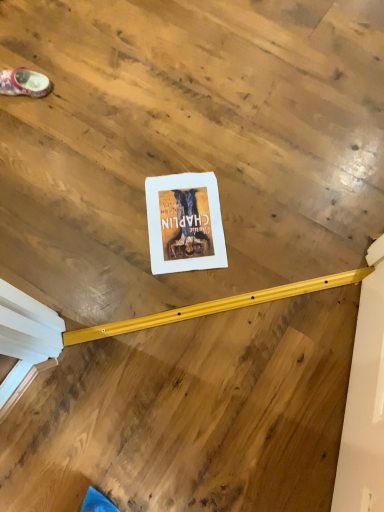
Question: From a real-world perspective, is white paper at center above or below matte pink fabric slipper at upper left?

Choices:
 (A) below
 (B) above

Answer: (A)

Question: In terms of size, does white paper at center appear bigger or smaller than matte pink fabric slipper at upper left?

Choices:
 (A) small
 (B) big

Answer: (A)

Question: Looking at their shapes, would you say white paper at center is wider or thinner than matte pink fabric slipper at upper left?

Choices:
 (A) thin
 (B) wide

Answer: (B)

Question: Is matte pink fabric slipper at upper left to the left or to the right of white paper at center in the image?

Choices:
 (A) left
 (B) right

Answer: (A)

Question: From a real-world perspective, is matte pink fabric slipper at upper left positioned above or below white paper at center?

Choices:
 (A) above
 (B) below

Answer: (A)

Question: Is matte pink fabric slipper at upper left wider or thinner than white paper at center?

Choices:
 (A) wide
 (B) thin

Answer: (B)

Question: Considering the positions of matte pink fabric slipper at upper left and white paper at center in the image, is matte pink fabric slipper at upper left bigger or smaller than white paper at center?

Choices:
 (A) small
 (B) big

Answer: (B)